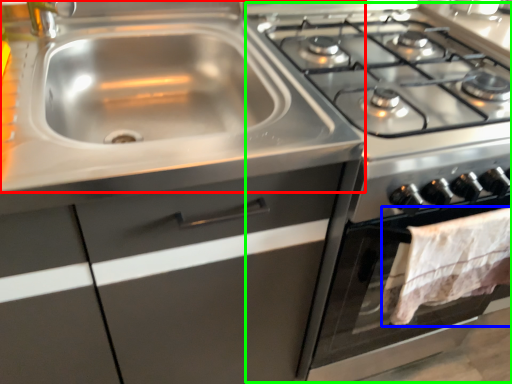
Question: Which object is the closest to the sink (highlighted by a red box)? Choose among these: blanket (highlighted by a blue box) or appliance (highlighted by a green box).

Choices:
 (A) blanket
 (B) appliance

Answer: (B)